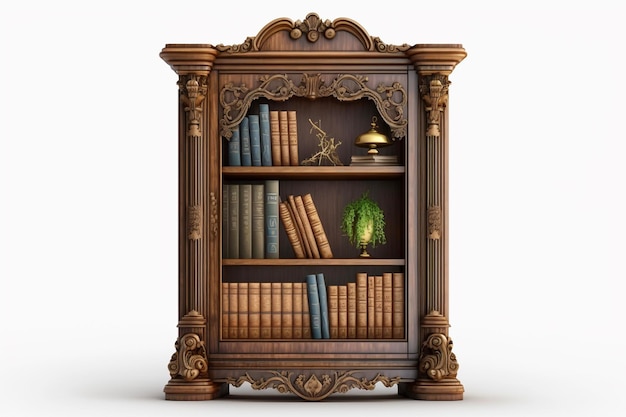
Where is `blue books`? blue books is located at coordinates (265, 137), (254, 140), (242, 143), (233, 148), (313, 298), (324, 298).